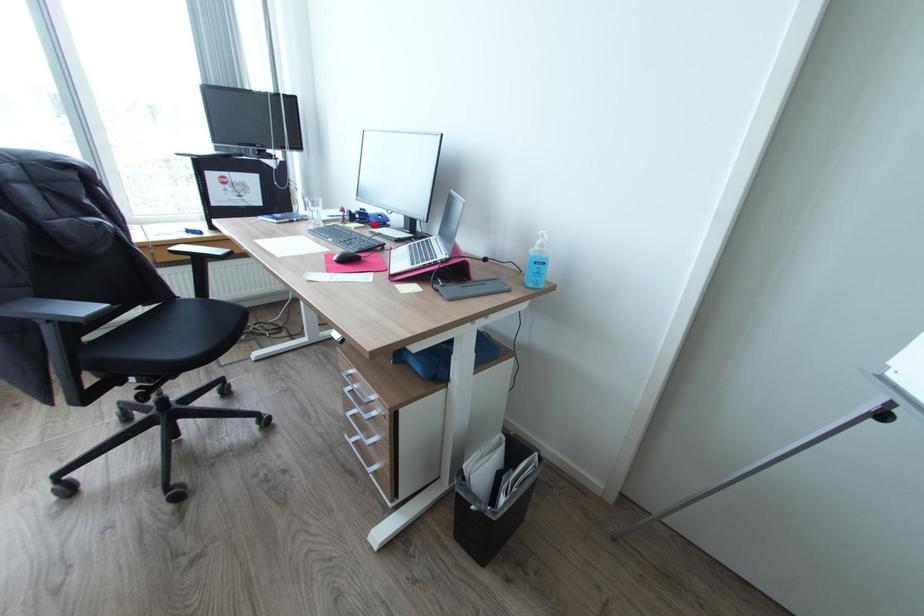
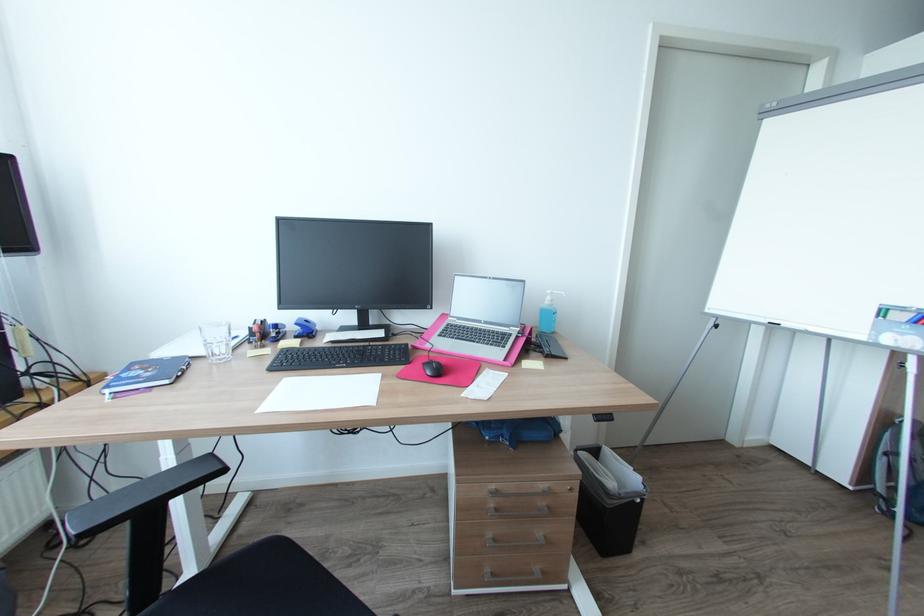
In the second image, find the point that corresponds to the highlighted location in the first image.

(301, 337)